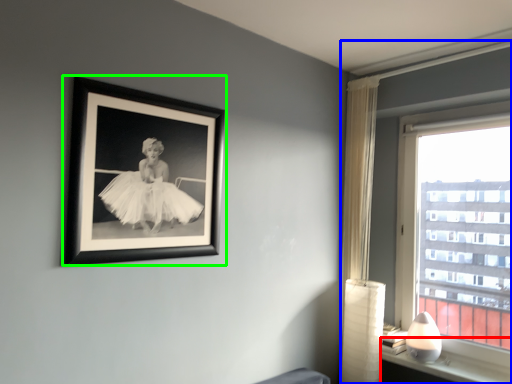
Question: Which object is the farthest from window sill (highlighted by a red box)? Choose among these: window (highlighted by a blue box) or picture frame (highlighted by a green box).

Choices:
 (A) window
 (B) picture frame

Answer: (B)